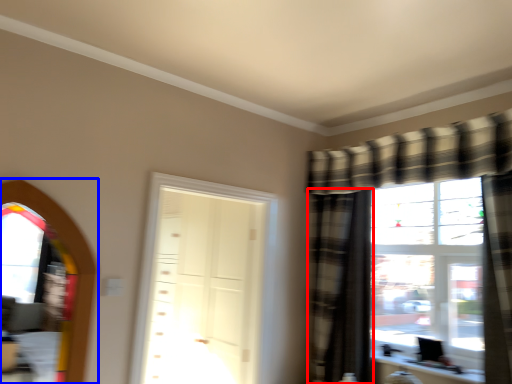
Question: Which point is further to the camera, curtain (highlighted by a red box) or window screen (highlighted by a blue box)?

Choices:
 (A) curtain
 (B) window screen

Answer: (A)